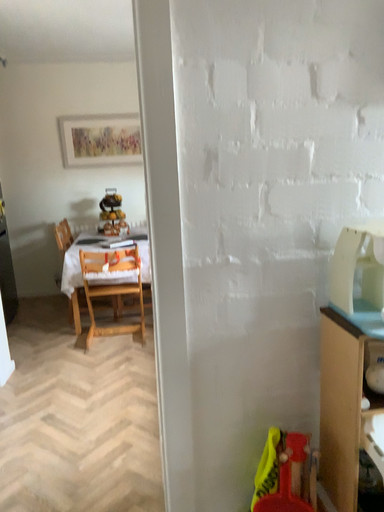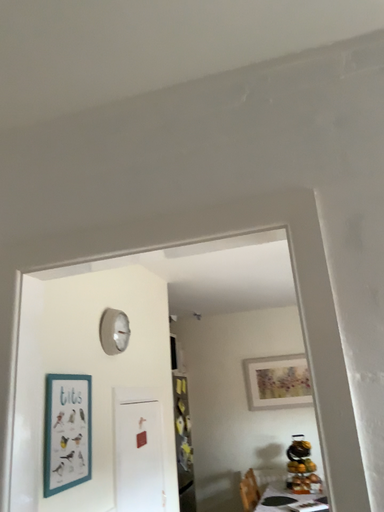
Question: Which way did the camera rotate in the video?

Choices:
 (A) rotated upward
 (B) rotated downward

Answer: (A)